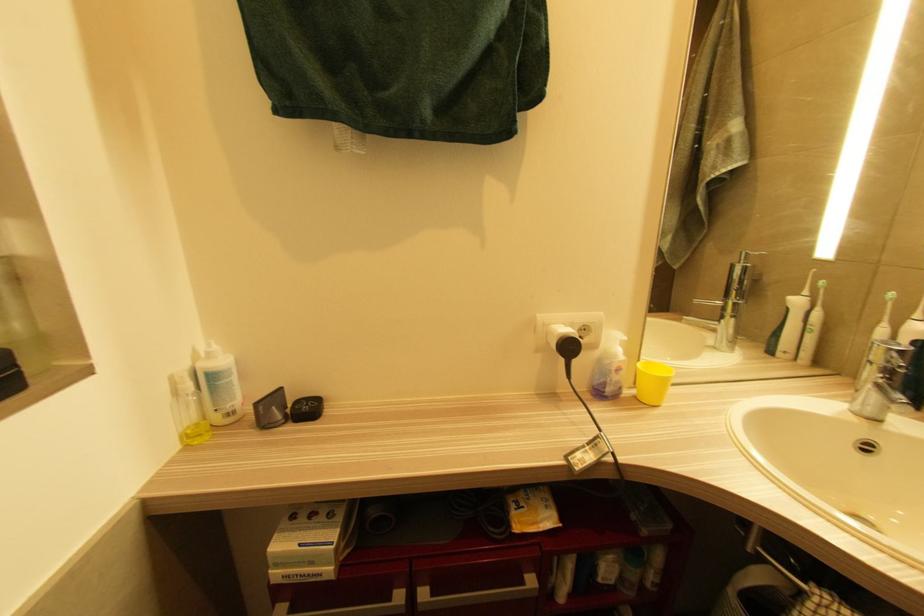
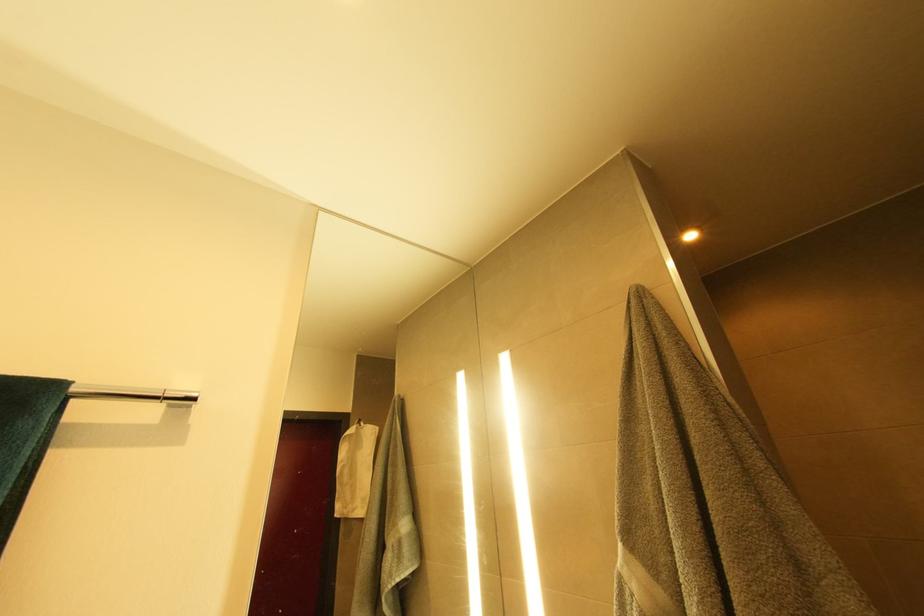
The images are taken continuously from a first-person perspective. In which direction is your viewpoint rotating?

The rotation direction of the camera is right-up.